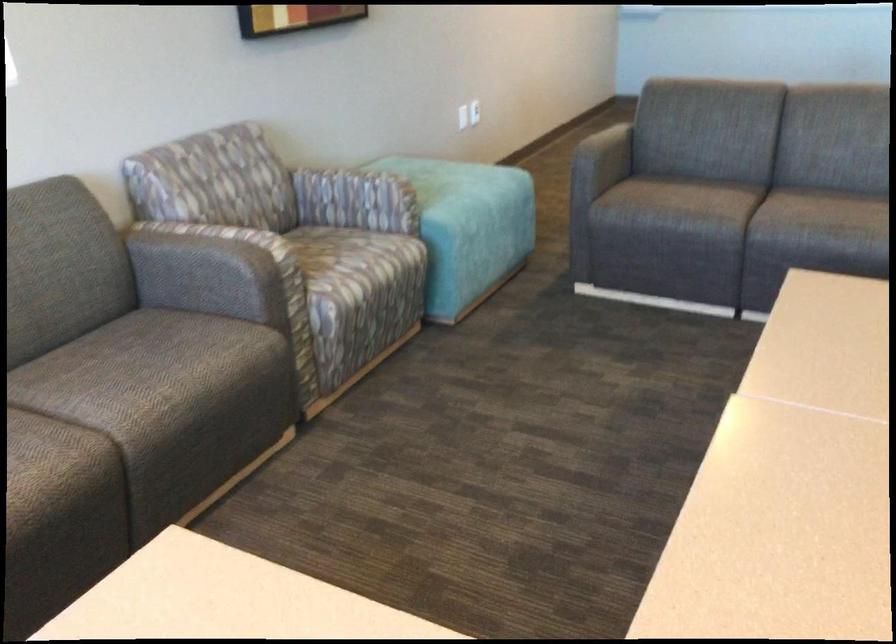
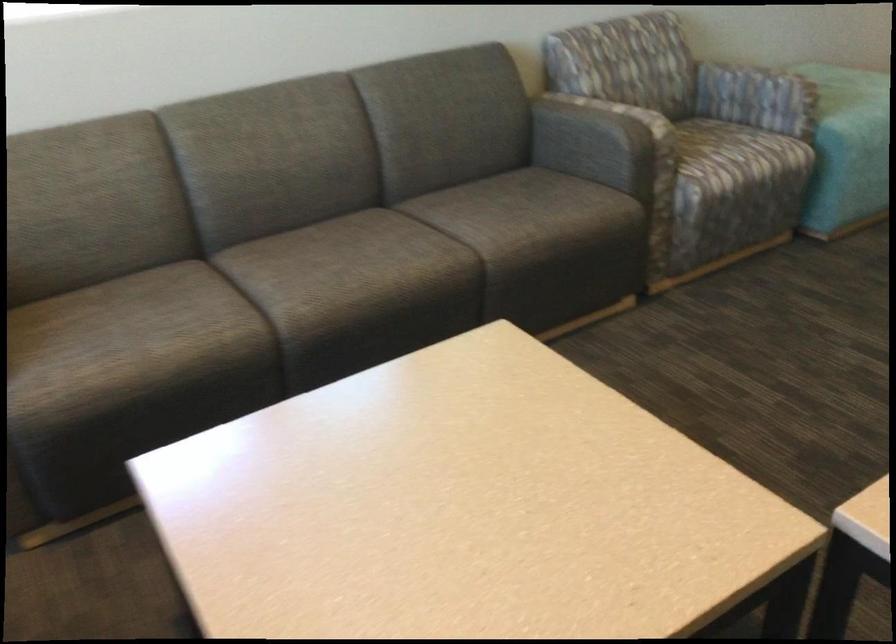
The point at (216, 277) is marked in the first image. Where is the corresponding point in the second image?

(597, 140)